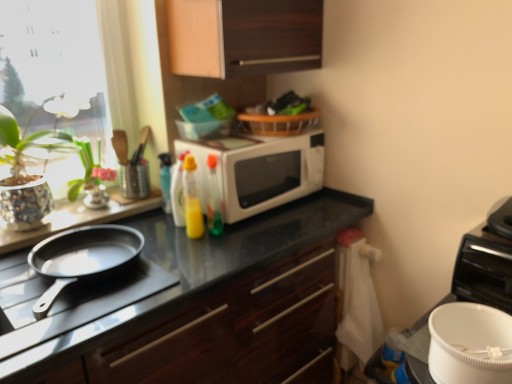
Question: Considering the relative sizes of green glossy vase at left and glossy dark wood cabinet at center, acting as the 2th cabinetry starting from the top, in the image provided, is green glossy vase at left wider than glossy dark wood cabinet at center, acting as the 2th cabinetry starting from the top,?

Choices:
 (A) yes
 (B) no

Answer: (B)

Question: Can you confirm if green glossy vase at left is bigger than glossy dark wood cabinet at center, the 1th cabinetry from the bottom?

Choices:
 (A) yes
 (B) no

Answer: (B)

Question: Can you confirm if green glossy vase at left is shorter than glossy dark wood cabinet at center, the 1th cabinetry from the bottom?

Choices:
 (A) yes
 (B) no

Answer: (A)

Question: Can you confirm if green glossy vase at left is positioned to the right of glossy dark wood cabinet at center, the 1th cabinetry from the bottom?

Choices:
 (A) yes
 (B) no

Answer: (B)

Question: From the image's perspective, would you say green glossy vase at left is shown under glossy dark wood cabinet at center, acting as the 2th cabinetry starting from the top?

Choices:
 (A) yes
 (B) no

Answer: (B)

Question: From a real-world perspective, does green glossy vase at left stand above glossy dark wood cabinet at center, the 1th cabinetry from the bottom?

Choices:
 (A) no
 (B) yes

Answer: (B)

Question: Can you confirm if translucent plastic bottle at center, the second bottle positioned from the right, is smaller than green glossy vase at left?

Choices:
 (A) no
 (B) yes

Answer: (B)

Question: Is translucent plastic bottle at center, marked as the 3th bottle in a left-to-right arrangement, bigger than green glossy vase at left?

Choices:
 (A) no
 (B) yes

Answer: (A)

Question: Is translucent plastic bottle at center, the second bottle positioned from the right, located outside green glossy vase at left?

Choices:
 (A) yes
 (B) no

Answer: (A)

Question: Can you confirm if translucent plastic bottle at center, marked as the 3th bottle in a left-to-right arrangement, is taller than green glossy vase at left?

Choices:
 (A) yes
 (B) no

Answer: (A)

Question: From the image's perspective, is translucent plastic bottle at center, marked as the 3th bottle in a left-to-right arrangement, on top of green glossy vase at left?

Choices:
 (A) yes
 (B) no

Answer: (B)

Question: Can you confirm if translucent plastic bottle at center, marked as the 3th bottle in a left-to-right arrangement, is thinner than green glossy vase at left?

Choices:
 (A) no
 (B) yes

Answer: (B)

Question: Can we say white glossy microwave at center lies outside green glossy vase at left?

Choices:
 (A) yes
 (B) no

Answer: (A)